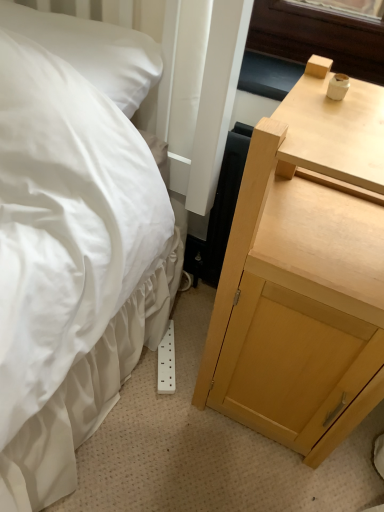
Where is `free spot in front of light wood nightstand at right`? free spot in front of light wood nightstand at right is located at coordinates (253, 483).